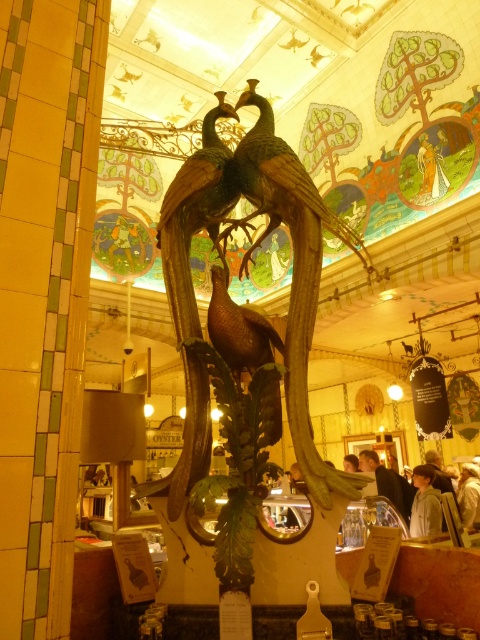
Who is lower down, shiny gold peacock at center or shiny metallic peacock at center?

Positioned lower is shiny gold peacock at center.

Which of these two, shiny gold peacock at center or shiny metallic peacock at center, stands shorter?

shiny metallic peacock at center

The image size is (480, 640). Find the location of `shiny gold peacock at center`. shiny gold peacock at center is located at coordinates 202,182.

In order to click on shiny gold peacock at center in this screenshot , I will do `click(202, 182)`.

Is wooden peacock at center behind shiny gold peacock at center?

No, wooden peacock at center is in front of shiny gold peacock at center.

Does point (172, 538) lie behind point (214, 131)?

No, it is in front of (214, 131).

Is point (172, 305) in front of point (180, 195)?

Yes, point (172, 305) is in front of point (180, 195).

This screenshot has height=640, width=480. What are the coordinates of `wooden peacock at center` in the screenshot? It's located at (252, 250).

Between wooden peacock at center and shiny bronze peacock at center, which one is positioned higher?

wooden peacock at center

Is point (312, 552) positioned in front of point (214, 339)?

Yes, it is.

Does point (181, 182) come in front of point (251, 321)?

No.

In order to click on wooden peacock at center in this screenshot , I will do `click(252, 250)`.